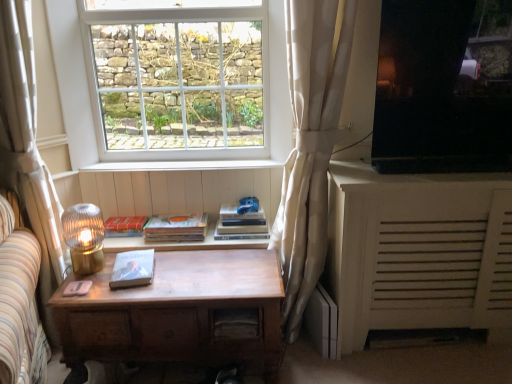
Question: From the image's perspective, is wooden desk at center located above or below white glass window at upper center?

Choices:
 (A) above
 (B) below

Answer: (B)

Question: Considering their positions, is wooden desk at center located in front of or behind white glass window at upper center?

Choices:
 (A) front
 (B) behind

Answer: (A)

Question: Estimate the real-world distances between objects in this image. Which object is farther from the hardcover book at center?

Choices:
 (A) white wood at center
 (B) white textured curtain at center, the first curtain viewed from the right
 (C) wooden drawer at center
 (D) wooden desk at center
 (E) white textured cabinet at right

Answer: (E)

Question: Estimate the real-world distances between objects in this image. Which object is farther from the wooden drawer at center?

Choices:
 (A) black glossy tv at upper right
 (B) matte red paperback book at center, which is counted as the 1th paperback book, starting from the back
 (C) white textured curtain at center, the first curtain viewed from the right
 (D) hardcover book at center, which appears as the second paperback book when viewed from the front
 (E) white wood at center

Answer: (A)